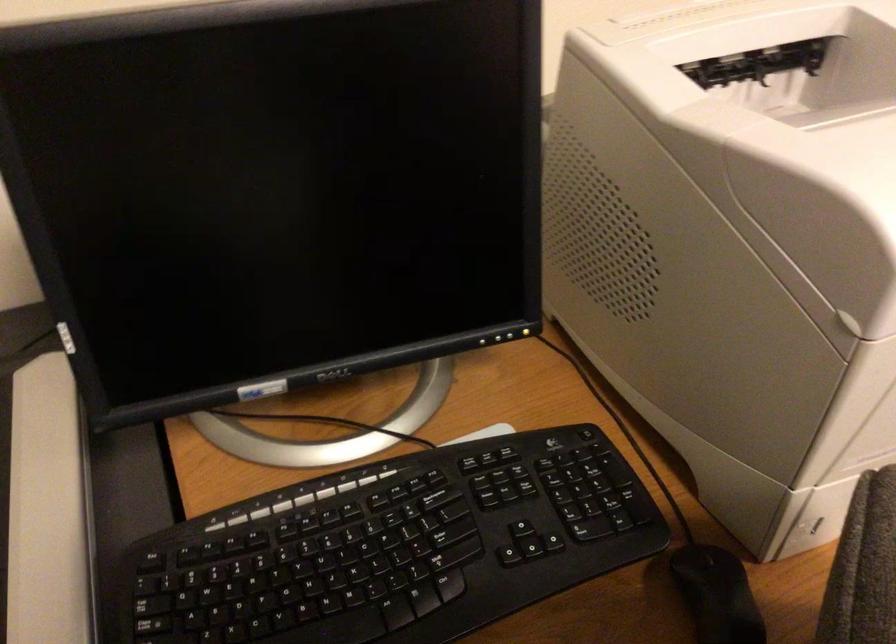
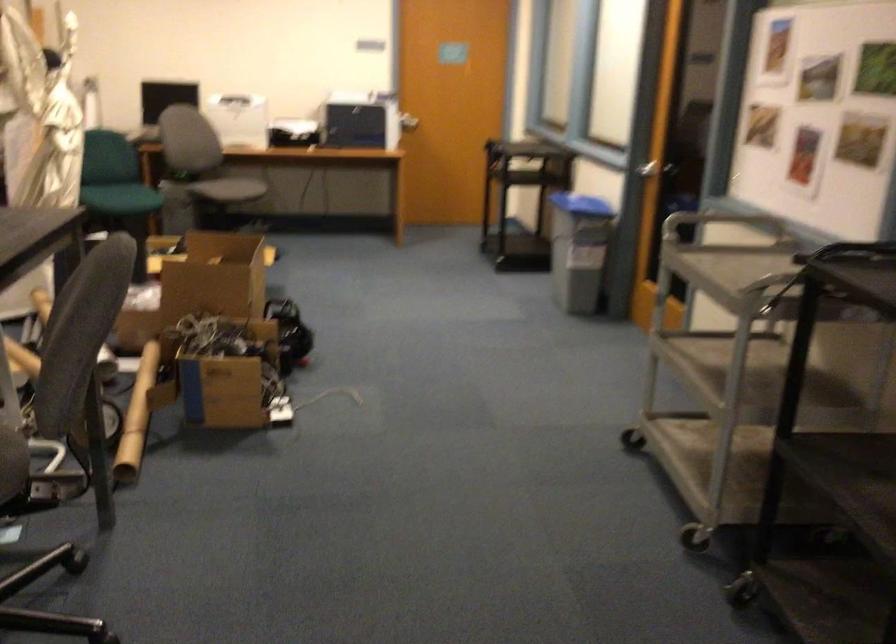
Question: I am providing you with two images of the same scene from different viewpoints. Please identify which objects are invisible in image2.

Choices:
 (A) silver cart handle
 (B) patterned bench surface
 (C) green chair sitting surface
 (D) black keyboard key

Answer: (D)